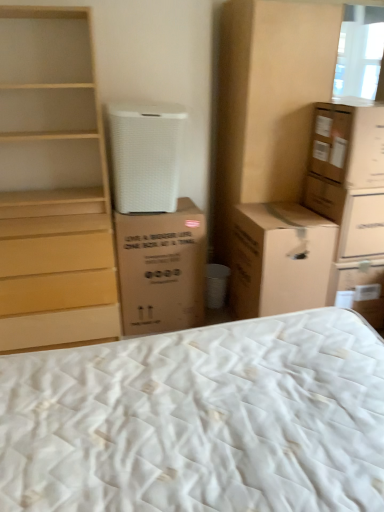
Question: From the image's perspective, is brown cardboard cabinet at upper right on top of light wood chest of drawers at left?

Choices:
 (A) yes
 (B) no

Answer: (A)

Question: Is brown cardboard cabinet at upper right at the right side of light wood chest of drawers at left?

Choices:
 (A) yes
 (B) no

Answer: (A)

Question: From the image's perspective, is brown cardboard cabinet at upper right located beneath light wood chest of drawers at left?

Choices:
 (A) no
 (B) yes

Answer: (A)

Question: Is brown cardboard cabinet at upper right oriented away from light wood chest of drawers at left?

Choices:
 (A) yes
 (B) no

Answer: (B)

Question: From a real-world perspective, is brown cardboard cabinet at upper right physically below light wood chest of drawers at left?

Choices:
 (A) no
 (B) yes

Answer: (A)

Question: Considering the positions of brown cardboard box at right, which is the fourth cardboard box in left-to-right order, and white matte air purifier at upper center in the image, is brown cardboard box at right, which is the fourth cardboard box in left-to-right order, taller or shorter than white matte air purifier at upper center?

Choices:
 (A) short
 (B) tall

Answer: (A)

Question: From the image's perspective, is brown cardboard box at right, which is counted as the 1th cardboard box, starting from the right, located above or below white matte air purifier at upper center?

Choices:
 (A) above
 (B) below

Answer: (B)

Question: Based on their positions, is brown cardboard box at right, which is the fourth cardboard box in left-to-right order, located to the left or right of white matte air purifier at upper center?

Choices:
 (A) right
 (B) left

Answer: (A)

Question: Looking at the image, does brown cardboard box at right, which is the fourth cardboard box in left-to-right order, seem bigger or smaller compared to white matte air purifier at upper center?

Choices:
 (A) big
 (B) small

Answer: (A)

Question: In terms of size, does brown cardboard box at right, which is counted as the 1th cardboard box, starting from the right, appear bigger or smaller than brown cardboard box at center, which is the 1th cardboard box in left-to-right order?

Choices:
 (A) big
 (B) small

Answer: (B)

Question: From a real-world perspective, is brown cardboard box at right, which is the fourth cardboard box in left-to-right order, positioned above or below brown cardboard box at center, which is the 1th cardboard box in left-to-right order?

Choices:
 (A) above
 (B) below

Answer: (A)

Question: Considering the positions of brown cardboard box at right, which is counted as the 1th cardboard box, starting from the right, and brown cardboard box at center, the 4th cardboard box from the right, in the image, is brown cardboard box at right, which is counted as the 1th cardboard box, starting from the right, taller or shorter than brown cardboard box at center, the 4th cardboard box from the right,?

Choices:
 (A) tall
 (B) short

Answer: (B)

Question: From the image's perspective, is brown cardboard box at right, which is the fourth cardboard box in left-to-right order, located above or below brown cardboard box at center, which is the 1th cardboard box in left-to-right order?

Choices:
 (A) above
 (B) below

Answer: (A)

Question: In the image, is brown cardboard cabinet at upper right on the left side or the right side of brown cardboard box at right, which is the fourth cardboard box in left-to-right order?

Choices:
 (A) left
 (B) right

Answer: (A)

Question: Would you say brown cardboard cabinet at upper right is inside or outside brown cardboard box at right, which is counted as the 1th cardboard box, starting from the right?

Choices:
 (A) outside
 (B) inside

Answer: (A)